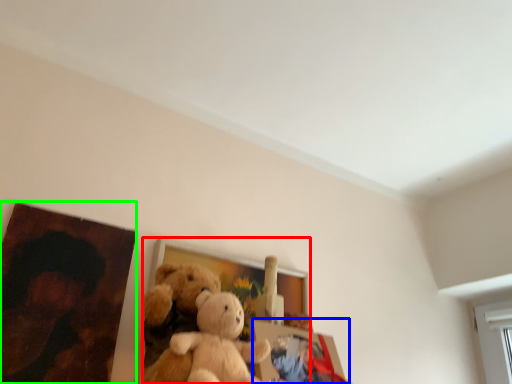
Question: Which object is positioned closest to picture frame (highlighted by a red box)? Select from picture frame (highlighted by a blue box) and picture frame (highlighted by a green box).

Choices:
 (A) picture frame
 (B) picture frame

Answer: (A)